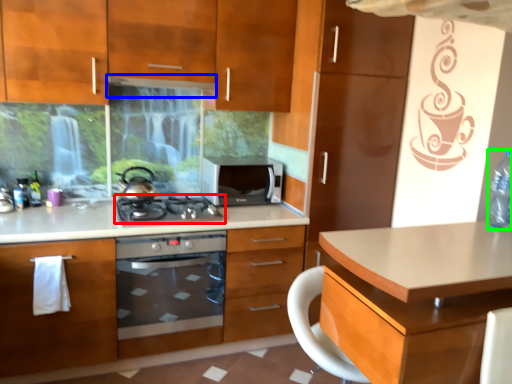
Question: Estimate the real-world distances between objects in this image. Which object is closer to gas stove (highlighted by a red box), exhaust hood (highlighted by a blue box) or bottle (highlighted by a green box)?

Choices:
 (A) exhaust hood
 (B) bottle

Answer: (A)